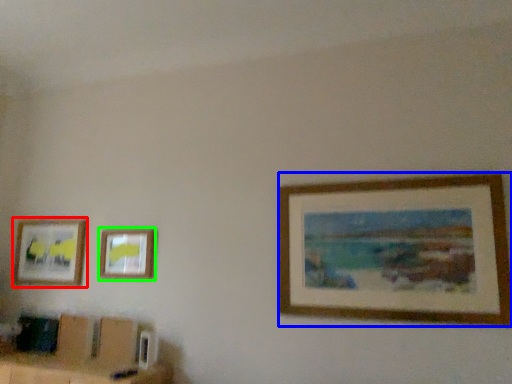
Question: Considering the real-world distances, which object is closest to picture frame (highlighted by a red box)? picture frame (highlighted by a blue box) or picture frame (highlighted by a green box).

Choices:
 (A) picture frame
 (B) picture frame

Answer: (B)